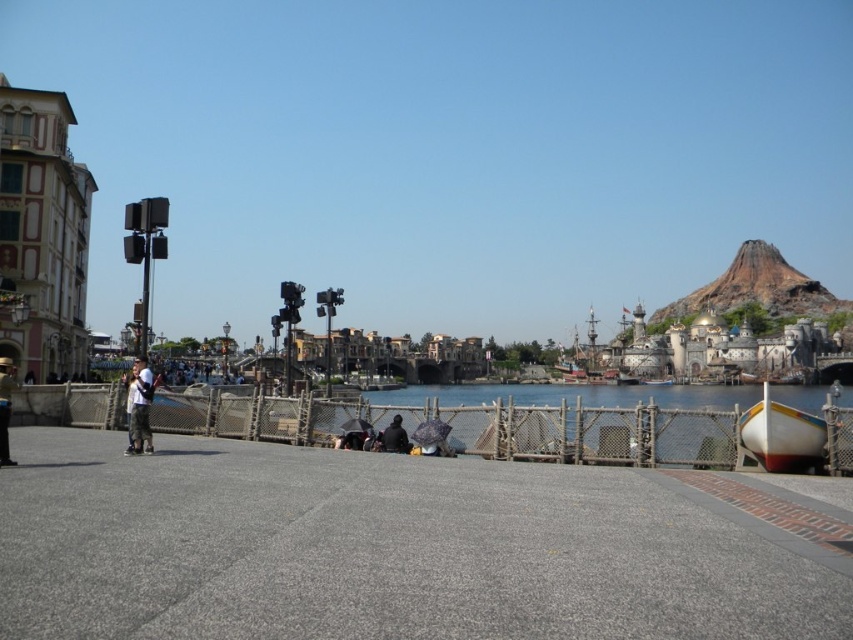
Does gray concrete plaza at center have a lesser width compared to white glossy boat at right?

In fact, gray concrete plaza at center might be wider than white glossy boat at right.

Who is more distant from viewer, (358, 481) or (747, 420)?

Point (747, 420)

Who is more distant from viewer, [42,534] or [820,428]?

The point [820,428] is behind.

You are a GUI agent. You are given a task and a screenshot of the screen. Output one action in this format:
    pyautogui.click(x=<x>, y=<y>)
    Task: Click on the gray concrete plaza at center
    
    Given the screenshot: What is the action you would take?
    pyautogui.click(x=386, y=548)

Is point (782, 616) farther from camera compared to point (7, 413)?

No, it is not.

Is point (160, 557) in front of point (0, 369)?

Yes, point (160, 557) is closer to viewer.

I want to click on gray concrete plaza at center, so click(x=386, y=548).

Looking at this image, does white glossy boat at right lie behind light blue jeans at center?

No, white glossy boat at right is closer to the viewer.

Locate an element on the screen. This screenshot has height=640, width=853. white glossy boat at right is located at coordinates (781, 435).

In order to click on white glossy boat at right in this screenshot , I will do `click(781, 435)`.